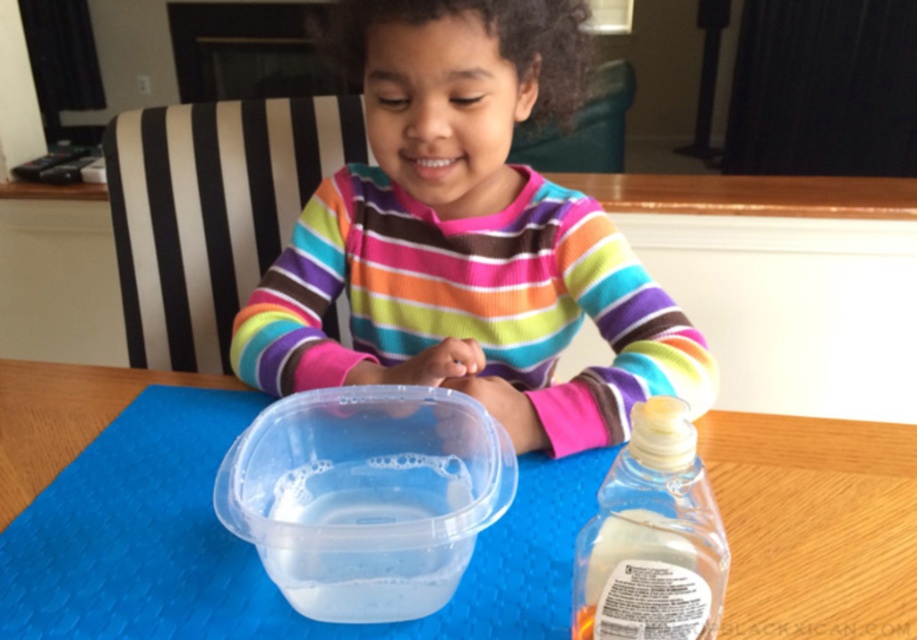
Is translucent plastic bottle at lower right closer to camera compared to transparent plastic water at center?

Yes, translucent plastic bottle at lower right is in front of transparent plastic water at center.

This screenshot has height=640, width=917. I want to click on translucent plastic bottle at lower right, so click(652, 538).

I want to click on translucent plastic bottle at lower right, so click(x=652, y=538).

Which is below, multicolored striped shirt at center or translucent plastic bottle at lower right?

translucent plastic bottle at lower right is below.

Which is in front, point (238, 369) or point (628, 461)?

Point (628, 461) is in front.

Locate an element on the screen. This screenshot has height=640, width=917. multicolored striped shirt at center is located at coordinates (467, 236).

In the scene shown: Is transparent plastic table at center shorter than translucent plastic bottle at lower right?

Incorrect, transparent plastic table at center's height does not fall short of translucent plastic bottle at lower right's.

Does transparent plastic table at center have a larger size compared to translucent plastic bottle at lower right?

Yes.

Is point (852, 467) positioned before point (606, 547)?

No, it is not.

Locate an element on the screen. The height and width of the screenshot is (640, 917). transparent plastic table at center is located at coordinates (815, 524).